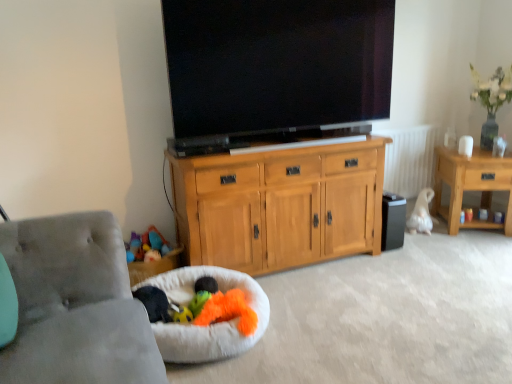
Question: From a real-world perspective, is light wood cabinet at center located beneath wooden side table at right?

Choices:
 (A) yes
 (B) no

Answer: (B)

Question: Is light wood cabinet at center wider than wooden side table at right?

Choices:
 (A) no
 (B) yes

Answer: (A)

Question: Can you confirm if light wood cabinet at center is positioned to the left of wooden side table at right?

Choices:
 (A) no
 (B) yes

Answer: (B)

Question: Is light wood cabinet at center smaller than wooden side table at right?

Choices:
 (A) yes
 (B) no

Answer: (B)

Question: Would you consider light wood cabinet at center to be distant from wooden side table at right?

Choices:
 (A) no
 (B) yes

Answer: (B)

Question: Is light wood cabinet at center positioned behind wooden side table at right?

Choices:
 (A) no
 (B) yes

Answer: (A)

Question: Are fluffy orange toy at lower center, which ranks as the 2th toy in top-to-bottom order, and smooth plastic cup at right, the 3th toy when ordered from front to back, making contact?

Choices:
 (A) no
 (B) yes

Answer: (A)

Question: Is smooth plastic cup at right, marked as the third toy in a left-to-right arrangement, inside fluffy orange toy at lower center, which ranks as the 2th toy in top-to-bottom order?

Choices:
 (A) yes
 (B) no

Answer: (B)

Question: Is fluffy orange toy at lower center, which is the second toy from front to back, located outside smooth plastic cup at right, acting as the 1th toy starting from the right?

Choices:
 (A) yes
 (B) no

Answer: (A)

Question: Is fluffy orange toy at lower center, which ranks as the 2th toy in top-to-bottom order, further to the viewer compared to smooth plastic cup at right, acting as the 1th toy starting from the right?

Choices:
 (A) yes
 (B) no

Answer: (B)

Question: Is fluffy orange toy at lower center, which ranks as the 2th toy in top-to-bottom order, not close to smooth plastic cup at right, marked as the 3th toy in a bottom-to-top arrangement?

Choices:
 (A) yes
 (B) no

Answer: (A)

Question: Can you confirm if fluffy orange toy at lower center, the second toy when ordered from back to front, is bigger than smooth plastic cup at right, marked as the first toy in a back-to-front arrangement?

Choices:
 (A) yes
 (B) no

Answer: (A)

Question: From a real-world perspective, is white fluffy dog bed at lower left physically above light wood cabinet at center?

Choices:
 (A) yes
 (B) no

Answer: (B)